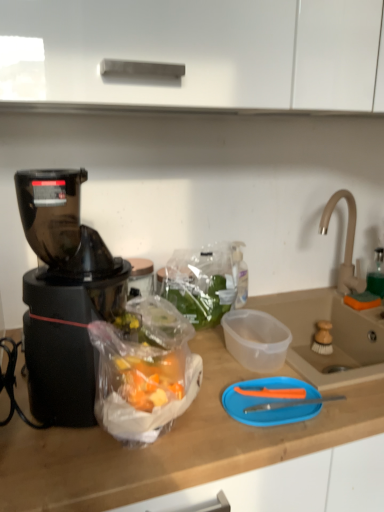
Question: Is transparent plastic sink at right, arranged as the second sink when viewed from the top, situated inside black plastic blender at left or outside?

Choices:
 (A) inside
 (B) outside

Answer: (B)

Question: Considering their positions, is transparent plastic sink at right, acting as the 1th sink starting from the bottom, located in front of or behind black plastic blender at left?

Choices:
 (A) behind
 (B) front

Answer: (A)

Question: Which object is positioned closest to the beige ceramic sink at right, which is counted as the first sink, starting from the top?

Choices:
 (A) white matte cabinet at upper center
 (B) black plastic blender at left
 (C) blue plastic cutting board at center
 (D) transparent plastic sink at right, arranged as the second sink when viewed from the top

Answer: (D)

Question: Considering the real-world distances, which object is closest to the transparent plastic sink at right, arranged as the second sink when viewed from the top?

Choices:
 (A) blue plastic cutting board at center
 (B) white matte cabinet at upper center
 (C) black plastic blender at left
 (D) beige ceramic sink at right, the 2th sink ordered from the bottom

Answer: (D)